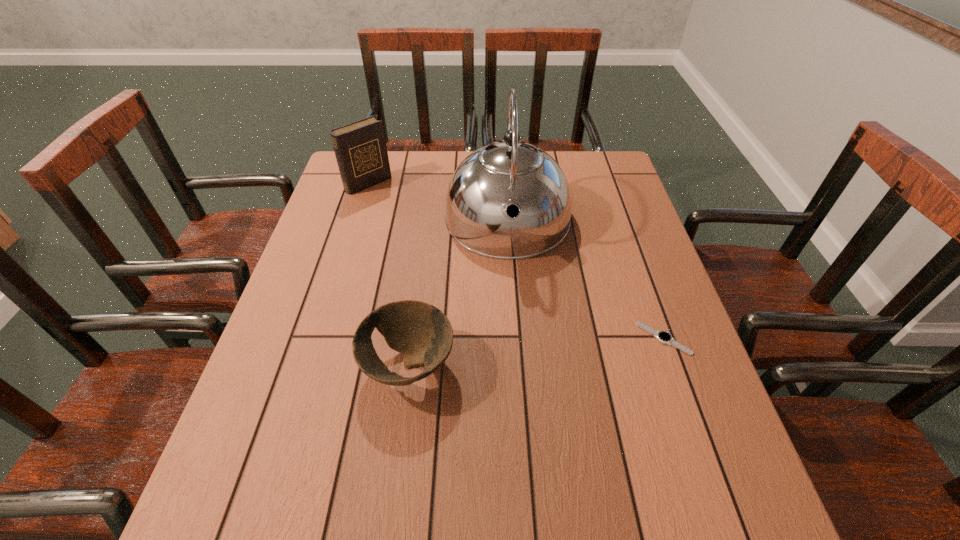
Where is `free spot between the shortest object and the second shortest object`? This screenshot has width=960, height=540. free spot between the shortest object and the second shortest object is located at coordinates (536, 352).

At what (x,y) coordinates should I click in order to perform the action: click on vacant space that is in between the second shortest object and the kettle. Please return your answer as a coordinate pair (x, y). Image resolution: width=960 pixels, height=540 pixels. Looking at the image, I should click on (458, 294).

At what (x,y) coordinates should I click in order to perform the action: click on empty location between the diary and the tallest object. Please return your answer as a coordinate pair (x, y). Looking at the image, I should click on (438, 202).

This screenshot has width=960, height=540. What are the coordinates of `vacant area that lies between the diary and the second shortest object` in the screenshot? It's located at (389, 274).

Where is `the closest object to the diary`? This screenshot has width=960, height=540. the closest object to the diary is located at coordinates (511, 175).

Identify the location of object that stands as the closest to the second shortest object. (511, 175).

I want to click on vacant space that satisfies the following two spatial constraints: 1. on the front side of the shortest object; 2. on the left side of the leftmost object, so (x=321, y=339).